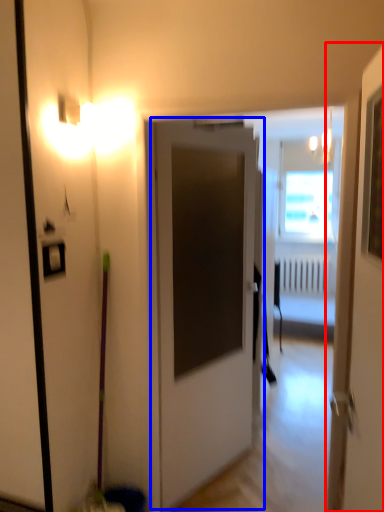
Question: Which object is closer to the camera taking this photo, door (highlighted by a red box) or door (highlighted by a blue box)?

Choices:
 (A) door
 (B) door

Answer: (A)